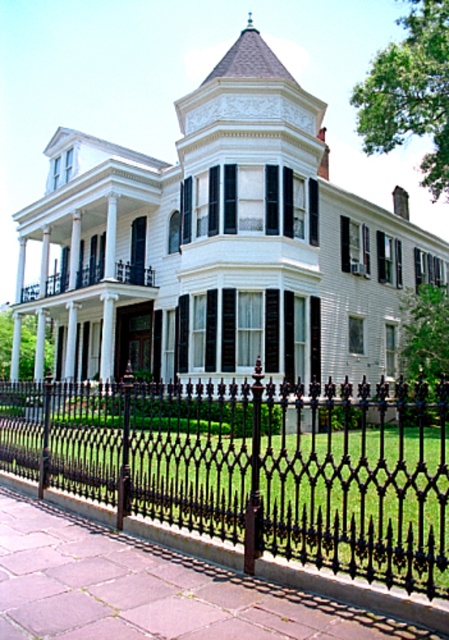
Does white matte house at center have a lesser width compared to white painted wood porch at center?

No.

Does point (146, 214) lie in front of point (133, 284)?

No, (146, 214) is behind (133, 284).

What do you see at coordinates (221, 244) in the screenshot? The image size is (449, 640). I see `white matte house at center` at bounding box center [221, 244].

This screenshot has height=640, width=449. Identify the location of white matte house at center. (221, 244).

Who is positioned more to the right, white matte house at center or black wrought iron fence at lower center?

black wrought iron fence at lower center

Is point (290, 108) positioned after point (8, 387)?

Yes, it is.

Does point (25, 234) come behind point (291, 401)?

Yes.

At what (x,y) coordinates should I click in order to perform the action: click on white matte house at center. Please return your answer as a coordinate pair (x, y). Looking at the image, I should click on (221, 244).

How far apart are black wrought iron fence at lower center and white painted wood porch at center?

31.54 feet

In order to click on black wrought iron fence at lower center in this screenshot , I will do `click(255, 465)`.